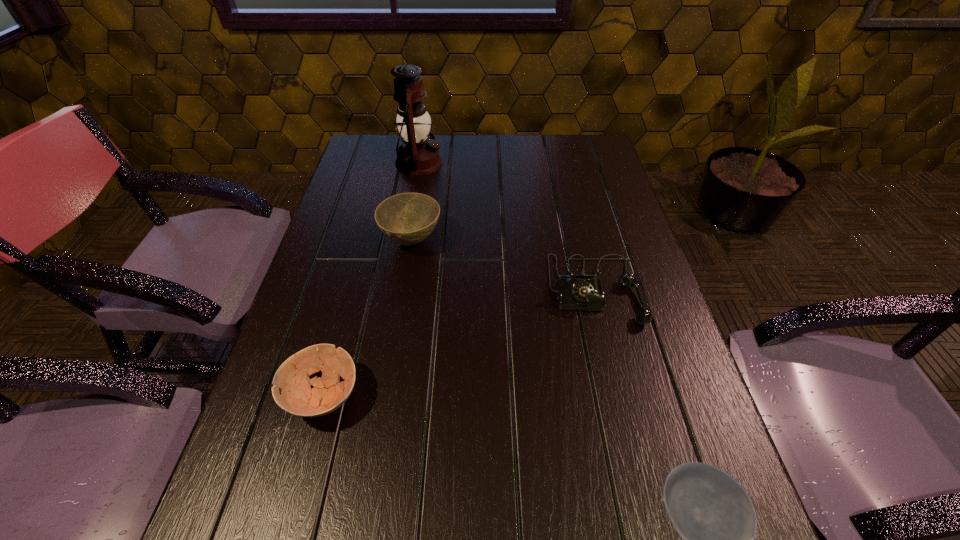
I want to click on lantern at the left edge, so click(x=418, y=155).

The height and width of the screenshot is (540, 960). In order to click on object that is positioned at the right edge in this screenshot , I will do `click(582, 290)`.

Find the location of `object situated at the far left corner`. object situated at the far left corner is located at coordinates (418, 155).

This screenshot has width=960, height=540. Find the location of `vacant space at the far edge of the desktop`. vacant space at the far edge of the desktop is located at coordinates (449, 145).

Find the location of a particular element. free space at the left edge of the desktop is located at coordinates (353, 314).

In the image, there is a desktop. At what (x,y) coordinates should I click in order to perform the action: click on free space at the right edge. Please return your answer as a coordinate pair (x, y). Looking at the image, I should click on (583, 245).

Identify the location of vacant space at the far left corner of the desktop. The image size is (960, 540). (372, 153).

Where is `free space between the second nearest bowl and the lantern`? The height and width of the screenshot is (540, 960). free space between the second nearest bowl and the lantern is located at coordinates (371, 279).

The height and width of the screenshot is (540, 960). I want to click on unoccupied area between the second nearest bowl and the telephone, so click(x=459, y=343).

I want to click on free space between the farthest bowl and the second farthest bowl, so click(368, 318).